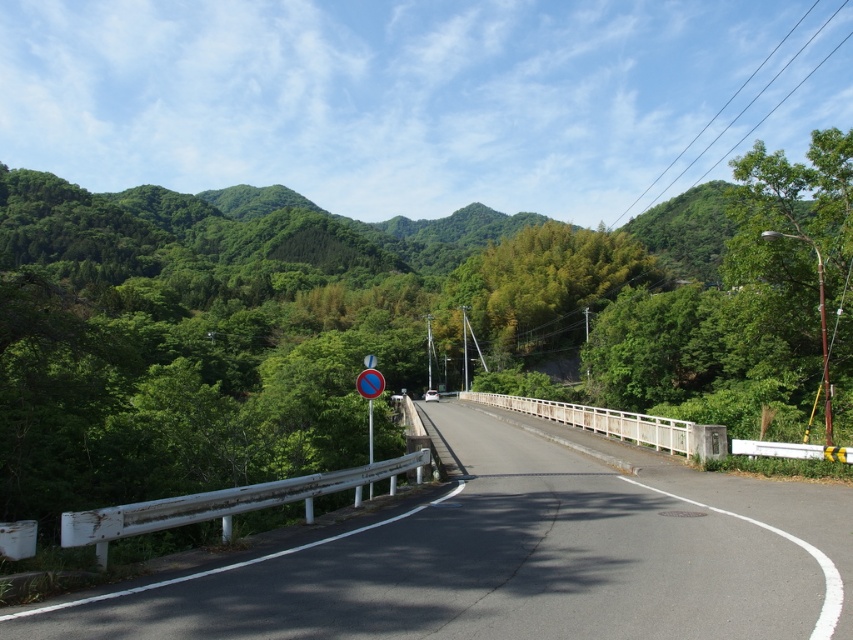
Question: Does green leafy tree at center have a smaller size compared to white metal guardrail at lower left?

Choices:
 (A) yes
 (B) no

Answer: (B)

Question: Does green leafy tree at right have a lesser width compared to white metal guardrail at lower left?

Choices:
 (A) yes
 (B) no

Answer: (B)

Question: Which point appears closest to the camera in this image?

Choices:
 (A) (403, 339)
 (B) (518, 563)

Answer: (B)

Question: Which of these objects is positioned closest to the green leafy tree at center?

Choices:
 (A) white metal guardrail at lower left
 (B) smooth asphalt highway at center
 (C) green leafy tree at right

Answer: (C)

Question: Among these objects, which one is farthest from the camera?

Choices:
 (A) green leafy tree at center
 (B) smooth asphalt highway at center
 (C) blue glossy sign at center

Answer: (C)

Question: Can you confirm if smooth asphalt highway at center is positioned above blue glossy sign at center?

Choices:
 (A) yes
 (B) no

Answer: (B)